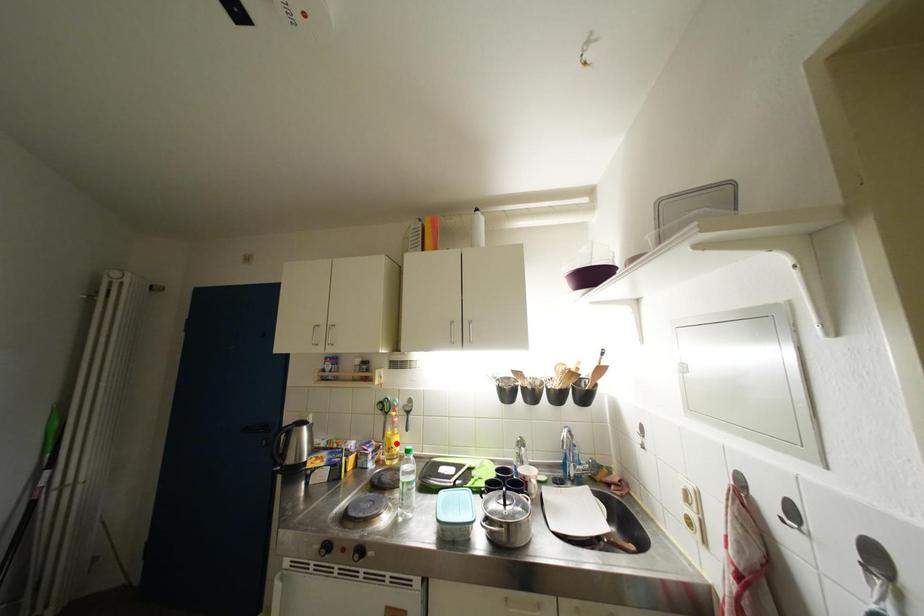
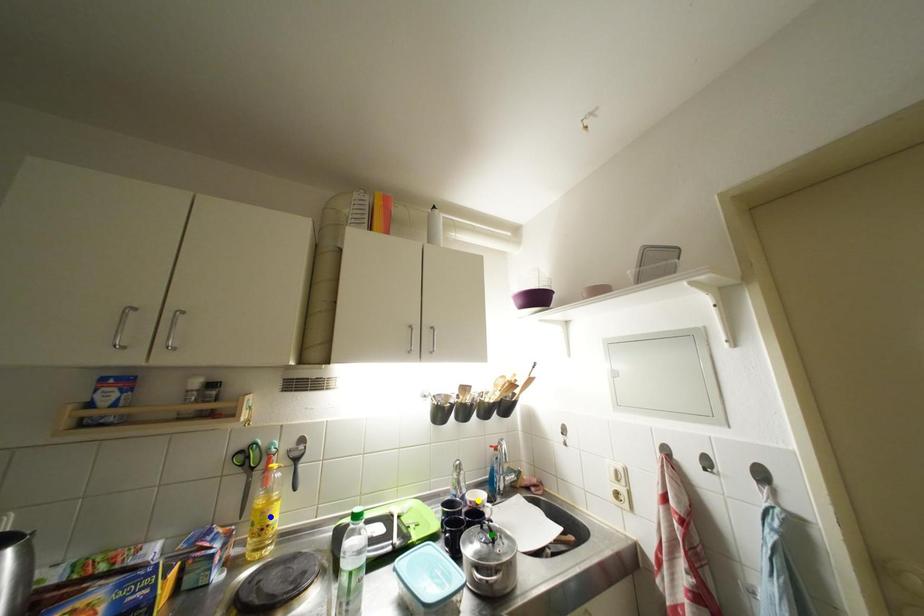
Question: I am providing you with two images of the same scene from different viewpoints. A red point is marked on the first image. You are given multiple points on the second image. Which point in image 2 is actually the same real-world point as the red point in image 1?

Choices:
 (A) blue point
 (B) green point
 (C) yellow point

Answer: (A)